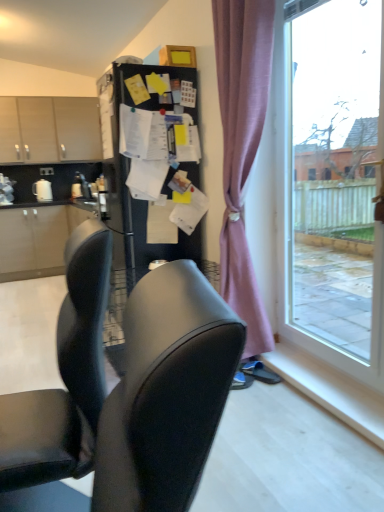
This screenshot has width=384, height=512. Find the location of `matte wood cabinets at upper left`. matte wood cabinets at upper left is located at coordinates (49, 129).

Describe the element at coordinates (129, 189) in the screenshot. This screenshot has width=384, height=512. I see `black matte refrigerator at center` at that location.

Where is `matte wood cabinets at upper left`? Image resolution: width=384 pixels, height=512 pixels. matte wood cabinets at upper left is located at coordinates (49, 129).

Looking at this image, considering the relative positions of black fabric chair at center and blue suede shoes at lower right in the image provided, is black fabric chair at center to the right of blue suede shoes at lower right from the viewer's perspective?

Incorrect, black fabric chair at center is not on the right side of blue suede shoes at lower right.

Consider the image. Which of these two, black fabric chair at center or blue suede shoes at lower right, is smaller?

blue suede shoes at lower right.

Between black fabric chair at center and blue suede shoes at lower right, which one has larger width?

black fabric chair at center.

Is black fabric chair at center positioned with its back to blue suede shoes at lower right?

No, blue suede shoes at lower right is not at the back of black fabric chair at center.

Are pink fabric curtain at right and matte wood cabinets at upper left far apart?

pink fabric curtain at right is far away from matte wood cabinets at upper left.

Measure the distance from pink fabric curtain at right to matte wood cabinets at upper left.

A distance of 3.88 meters exists between pink fabric curtain at right and matte wood cabinets at upper left.

Considering the relative sizes of pink fabric curtain at right and matte wood cabinets at upper left in the image provided, is pink fabric curtain at right taller than matte wood cabinets at upper left?

Yes, pink fabric curtain at right is taller than matte wood cabinets at upper left.

Considering the sizes of pink fabric curtain at right and matte wood cabinets at upper left in the image, is pink fabric curtain at right bigger or smaller than matte wood cabinets at upper left?

Considering their sizes, pink fabric curtain at right takes up less space than matte wood cabinets at upper left.

Looking at this image, measure the distance from matte wood cabinets at upper left to white glossy paper towel dispenser at left.

They are 32.42 inches apart.

Between matte wood cabinets at upper left and white glossy paper towel dispenser at left, which one has less height?

white glossy paper towel dispenser at left is shorter.

Would you say matte wood cabinets at upper left is inside or outside white glossy paper towel dispenser at left?

matte wood cabinets at upper left is outside white glossy paper towel dispenser at left.

Is matte wood cabinets at upper left wider or thinner than white glossy paper towel dispenser at left?

Clearly, matte wood cabinets at upper left has more width compared to white glossy paper towel dispenser at left.

Is pink fabric curtain at right turned away from transparent glass window at right?

That's right, pink fabric curtain at right is facing away from transparent glass window at right.

Are pink fabric curtain at right and transparent glass window at right located far from each other?

pink fabric curtain at right is near transparent glass window at right, not far away.

Can you confirm if pink fabric curtain at right is positioned to the left of transparent glass window at right?

Indeed, pink fabric curtain at right is positioned on the left side of transparent glass window at right.

From the image's perspective, is pink fabric curtain at right positioned above or below transparent glass window at right?

From the image's perspective, pink fabric curtain at right appears above transparent glass window at right.

Looking at this image, from the image's perspective, which object appears higher, black fabric chair at center or white glossy paper towel dispenser at left?

white glossy paper towel dispenser at left, from the image's perspective.

Consider the image. From a real-world perspective, which object stands above the other?

From a 3D spatial view, white glossy paper towel dispenser at left is above.

Measure the distance between black fabric chair at center and white glossy paper towel dispenser at left.

black fabric chair at center and white glossy paper towel dispenser at left are 4.30 meters apart.

Where is `chair below the white glossy paper towel dispenser at left (from the image's perspective)`? chair below the white glossy paper towel dispenser at left (from the image's perspective) is located at coordinates (127, 387).

Does matte wood cabinets at upper left lie in front of transparent glass window at right?

No, matte wood cabinets at upper left is behind transparent glass window at right.

Can you confirm if matte wood cabinets at upper left is bigger than transparent glass window at right?

Yes, matte wood cabinets at upper left is bigger than transparent glass window at right.

Is matte wood cabinets at upper left looking in the opposite direction of transparent glass window at right?

No, matte wood cabinets at upper left is not facing away from transparent glass window at right.

From the image's perspective, which one is positioned higher, matte wood cabinets at upper left or transparent glass window at right?

matte wood cabinets at upper left, from the image's perspective.

Considering the positions of point (50, 182) and point (206, 314), is point (50, 182) closer or farther from the camera than point (206, 314)?

Point (50, 182) is positioned farther from the camera compared to point (206, 314).

Which of these two, white glossy paper towel dispenser at left or black fabric chair at center, is wider?

black fabric chair at center is wider.

Is black fabric chair at center at the back of white glossy paper towel dispenser at left?

No, white glossy paper towel dispenser at left is not facing the opposite direction of black fabric chair at center.

Between white glossy paper towel dispenser at left and black fabric chair at center, which one appears on the right side from the viewer's perspective?

From the viewer's perspective, black fabric chair at center appears more on the right side.

Identify the location of chair on the left of blue suede shoes at lower right. Image resolution: width=384 pixels, height=512 pixels. (127, 387).

At what (x,y) coordinates should I click in order to perform the action: click on curtain below the matte wood cabinets at upper left (from the image's perspective). Please return your answer as a coordinate pair (x, y). The width and height of the screenshot is (384, 512). Looking at the image, I should click on (242, 148).

Based on their spatial positions, is transparent glass window at right or black fabric chair at center closer to black matte refrigerator at center?

transparent glass window at right.

From the image, which object appears to be nearer to black matte refrigerator at center, white glossy paper towel dispenser at left or matte wood cabinets at upper left?

white glossy paper towel dispenser at left is positioned closer to the anchor black matte refrigerator at center.

When comparing their distances from transparent glass window at right, does pink fabric curtain at right or black fabric chair at center seem closer?

pink fabric curtain at right lies closer to transparent glass window at right than the other object.

Which object lies nearer to the anchor point blue suede shoes at lower right, black matte refrigerator at center or transparent glass window at right?

transparent glass window at right.

Looking at this image, estimate the real-world distances between objects in this image. Which object is further from transparent glass window at right, black matte refrigerator at center or blue suede shoes at lower right?

blue suede shoes at lower right.

From the image, which object appears to be farther from pink fabric curtain at right, black fabric chair at center or white glossy paper towel dispenser at left?

Based on the image, white glossy paper towel dispenser at left appears to be further to pink fabric curtain at right.

Considering their positions, is blue suede shoes at lower right positioned closer to black matte refrigerator at center than pink fabric curtain at right?

pink fabric curtain at right.

Which object lies nearer to the anchor point matte wood cabinets at upper left, transparent glass window at right or pink fabric curtain at right?

Among the two, pink fabric curtain at right is located nearer to matte wood cabinets at upper left.

The width and height of the screenshot is (384, 512). What are the coordinates of `curtain between black fabric chair at center and black matte refrigerator at center along the z-axis` in the screenshot? It's located at (242, 148).

Locate an element on the screen. This screenshot has height=512, width=384. footwear between black fabric chair at center and black matte refrigerator at center in the front-back direction is located at coordinates (260, 372).

Locate an element on the screen. The width and height of the screenshot is (384, 512). fridge positioned between blue suede shoes at lower right and matte wood cabinets at upper left from near to far is located at coordinates (129, 189).

I want to click on curtain between transparent glass window at right and matte wood cabinets at upper left from front to back, so click(242, 148).